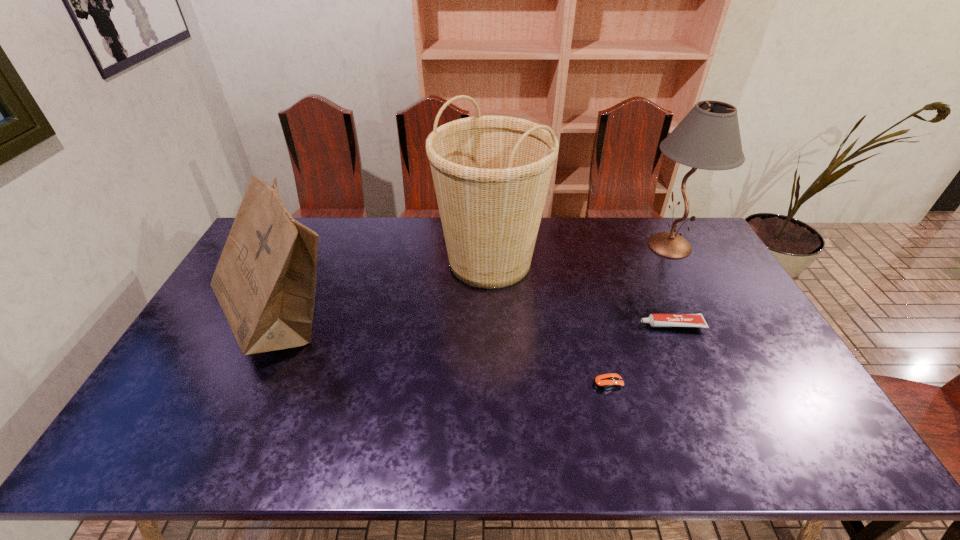
You are a GUI agent. You are given a task and a screenshot of the screen. Output one action in this format:
    pyautogui.click(x=<x>, y=<y>)
    Task: Click on the free spot located on the front-facing side of the table lamp
    
    Given the screenshot: What is the action you would take?
    pyautogui.click(x=608, y=246)

Find the location of `free space located on the front of the leftmost object`. free space located on the front of the leftmost object is located at coordinates (244, 404).

Image resolution: width=960 pixels, height=540 pixels. I want to click on free region located at the nozzle of the fourth tallest object, so click(532, 325).

At what (x,y) coordinates should I click in order to perform the action: click on free space located 0.150m at the nozzle of the fourth tallest object. Please return your answer as a coordinate pair (x, y). Looking at the image, I should click on (589, 325).

Identify the location of free point located 0.230m at the nozzle of the fourth tallest object. (563, 325).

What are the coordinates of `free space located 0.140m on the left of the shortest object` in the screenshot? It's located at (539, 383).

The height and width of the screenshot is (540, 960). Identify the location of basket located at the far edge. (491, 174).

The image size is (960, 540). What are the coordinates of `table lamp located at the far edge` in the screenshot? It's located at (708, 137).

Find the location of a particular element. This screenshot has height=540, width=960. object that is at the left edge is located at coordinates (x=265, y=281).

At what (x,y) coordinates should I click in order to perform the action: click on object located at the right edge. Please return your answer as a coordinate pair (x, y). Looking at the image, I should click on (708, 137).